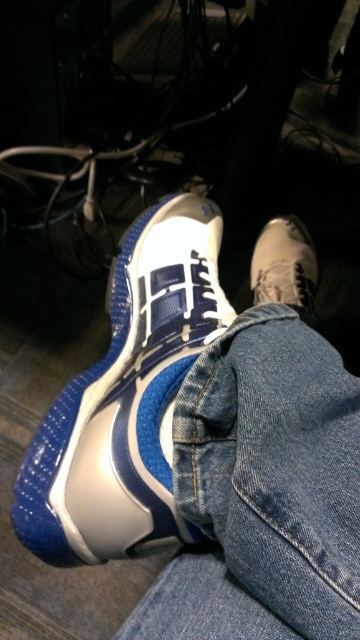
You are taking a photo of the white sneaker with blue accents. There are two points marked on the shoe, one at coordinates point (194, 198) and the other at point (285, 282). Which point appears closer to you in the photo?

Point (194, 198) is closer to the camera than point (285, 282), so the point at coordinates point (194, 198) appears closer to you in the photo.

You are a tailor trying to determine if the denim at lower left can be used to cover the blue rubber sneaker at lower left. Based on their sizes, what do you think?

The denim at lower left has a smaller size compared to the blue rubber sneaker at lower left, so it cannot fully cover the sneaker.

You are standing in a store trying to decide between the blue rubber sneaker at lower left and the leather sneaker at lower right. Which one is positioned lower in the image?

The blue rubber sneaker at lower left is located below the leather sneaker at lower right, so it is positioned lower in the image.